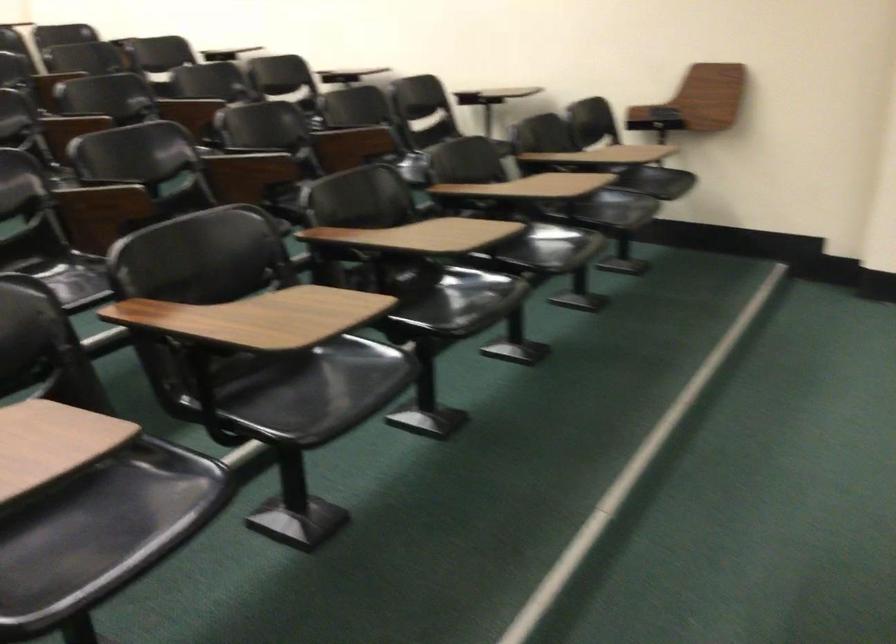
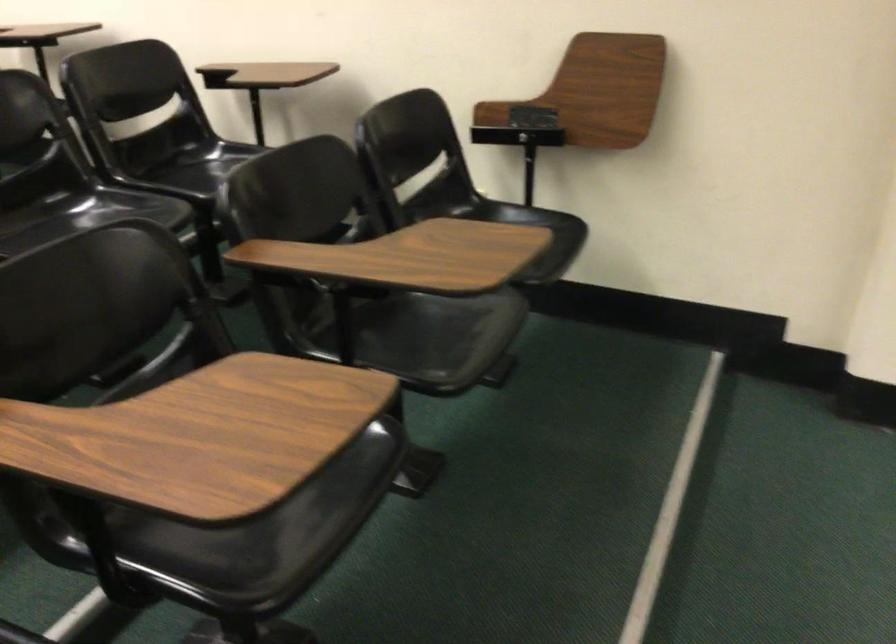
What movement of the cameraman would produce the second image?

The cameraman moved toward right, forward.